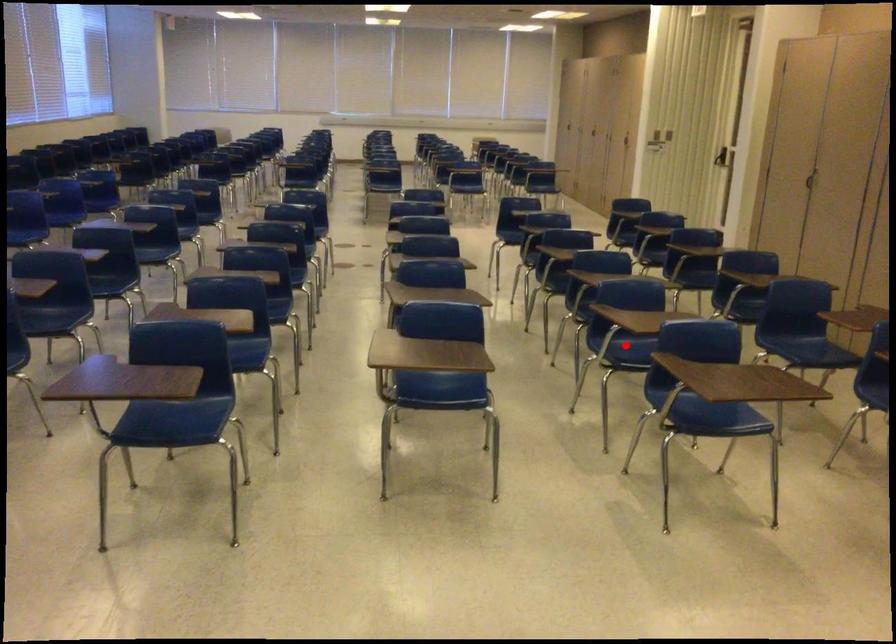
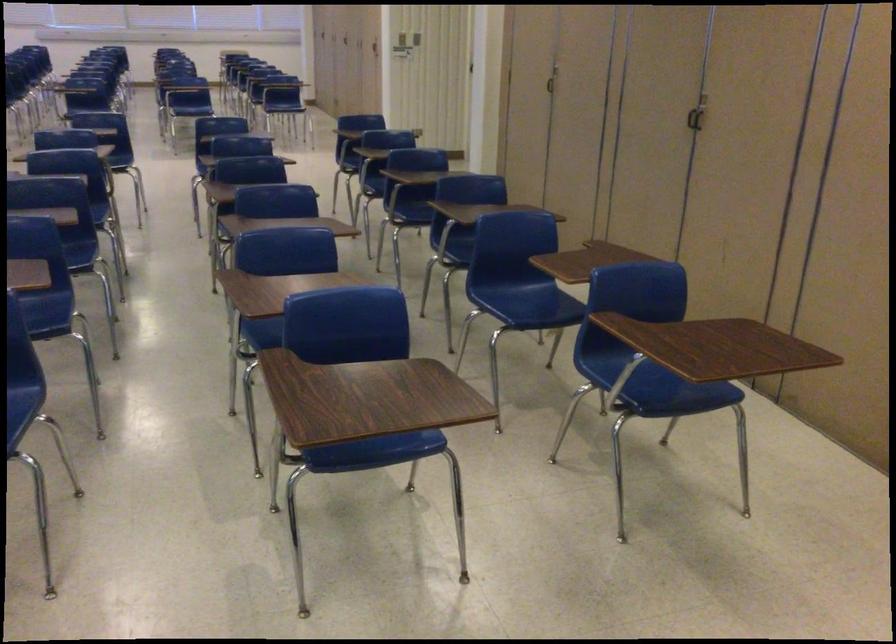
Question: I am providing you with two images of the same scene from different viewpoints. A red point is marked on the first image. Can you still see the location of the red point in image 2?

Choices:
 (A) Yes
 (B) No

Answer: (B)